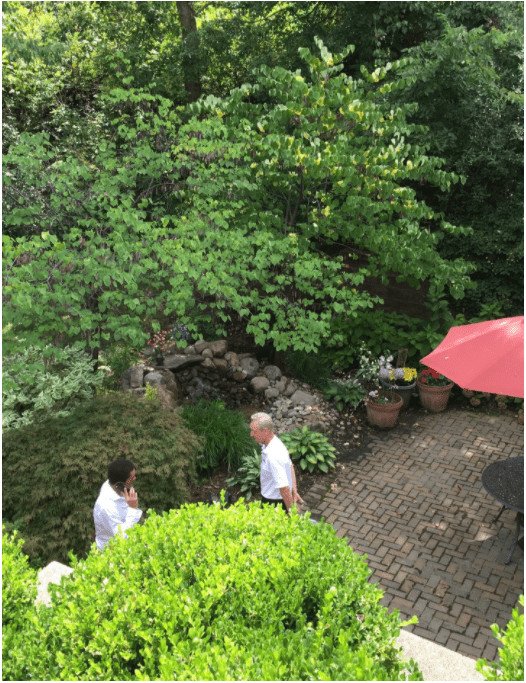
Locate an element on the screen. ledge is located at coordinates (434, 656).